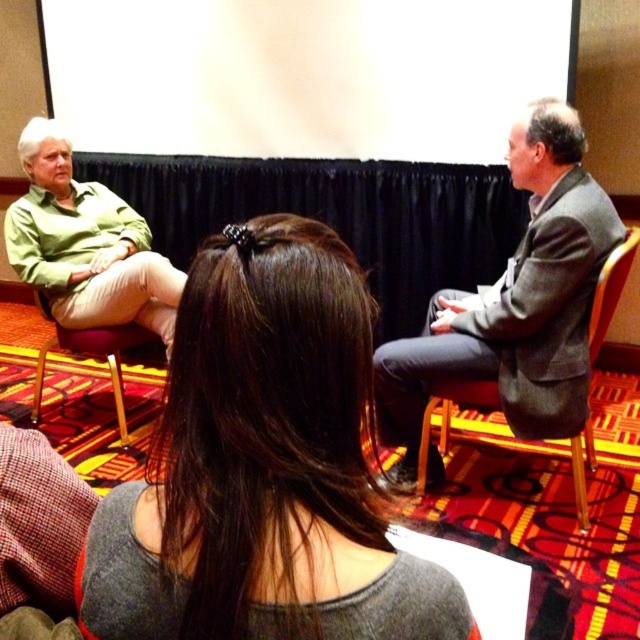
Question: Which point appears farthest from the camera in this image?

Choices:
 (A) (36, 301)
 (B) (61, 292)
 (C) (268, 417)
 (D) (468, 35)

Answer: (D)

Question: Is gray suit at right smaller than green matte shirt at left?

Choices:
 (A) yes
 (B) no

Answer: (B)

Question: Estimate the real-world distances between objects in this image. Which object is farther from the green matte shirt at left?

Choices:
 (A) gray suit at right
 (B) wooden chair at left
 (C) dark brown hair at center
 (D) white matte projection screen at upper center

Answer: (C)

Question: Which of the following is the farthest from the observer?

Choices:
 (A) (298, 4)
 (B) (83, 189)
 (C) (536, 220)

Answer: (A)

Question: Does dark brown hair at center have a lesser width compared to green matte shirt at left?

Choices:
 (A) no
 (B) yes

Answer: (B)

Question: Does white matte projection screen at upper center come behind wooden chair at left?

Choices:
 (A) no
 (B) yes

Answer: (A)